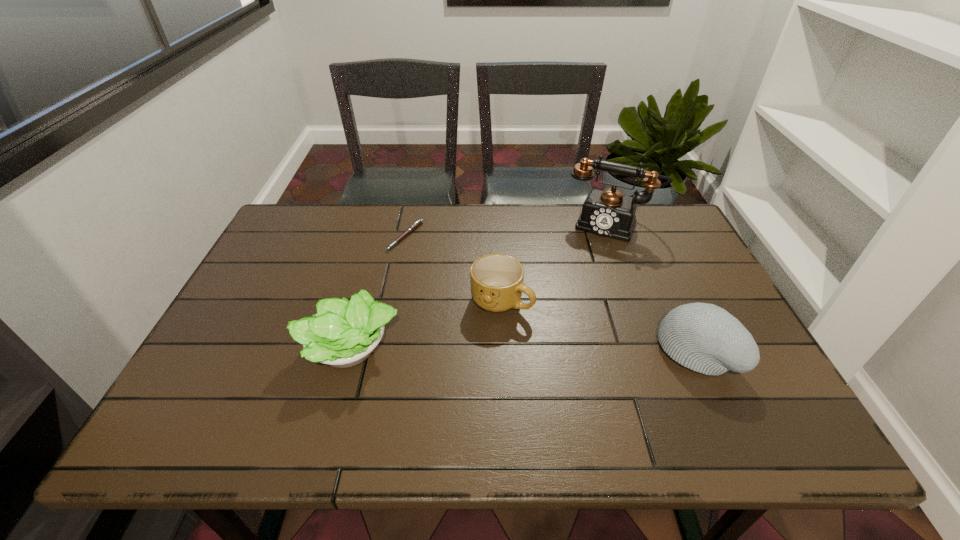
Find the location of a particular element. object that can be found as the third closest to the third object from left to right is located at coordinates (609, 213).

You are a GUI agent. You are given a task and a screenshot of the screen. Output one action in this format:
    pyautogui.click(x=<x>, y=<y>)
    Task: Click on the object that stands as the second closest to the mug
    The width and height of the screenshot is (960, 540).
    Given the screenshot: What is the action you would take?
    pyautogui.click(x=419, y=222)